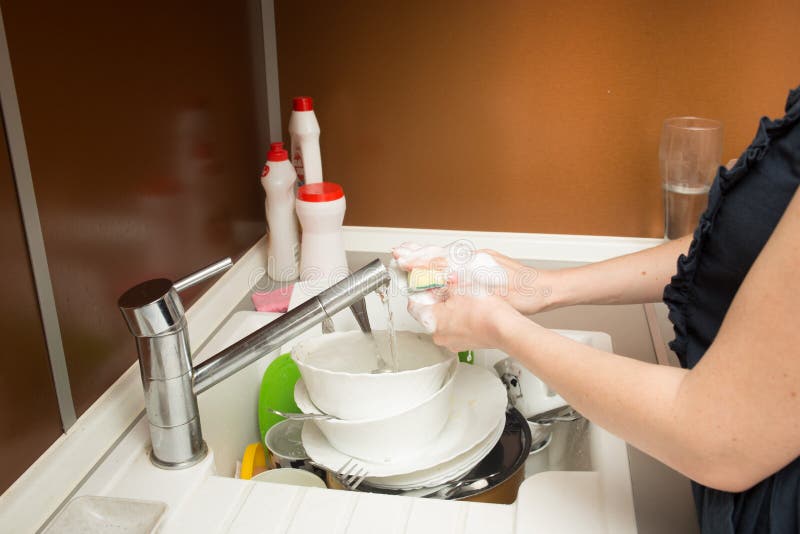
This screenshot has height=534, width=800. What are the coordinates of `fork` in the screenshot? It's located at (353, 479).